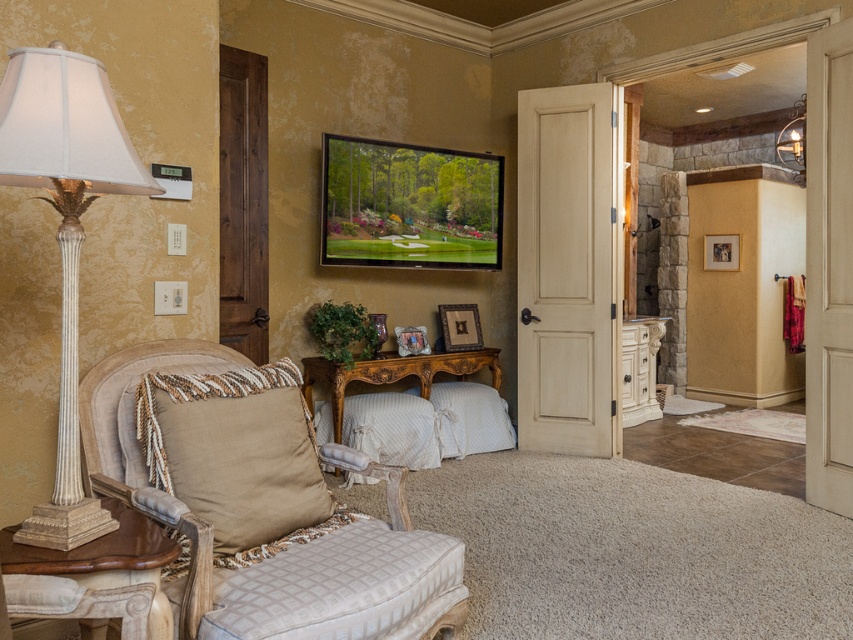
Question: Considering the relative positions of beige fabric armchair at lower left and wooden carved console table at center in the image provided, where is beige fabric armchair at lower left located with respect to wooden carved console table at center?

Choices:
 (A) right
 (B) left

Answer: (B)

Question: Is beige fabric pillow at lower left thinner than white quilted fabric stool at lower left?

Choices:
 (A) no
 (B) yes

Answer: (B)

Question: Among these points, which one is farthest from the camera?

Choices:
 (A) (795, 168)
 (B) (339, 564)
 (C) (100, 560)

Answer: (A)

Question: Observing the image, what is the correct spatial positioning of white quilted fabric stool at lower left in reference to wooden carved console table at center?

Choices:
 (A) left
 (B) right

Answer: (A)

Question: Considering the real-world distances, which object is closest to the metallic gold sconce at upper right?

Choices:
 (A) wooden carved console table at center
 (B) white textured lamp at left
 (C) wooden table at left

Answer: (A)

Question: Considering the real-world distances, which object is farthest from the beige fabric armchair at lower left?

Choices:
 (A) metallic gold sconce at upper right
 (B) white textured lamp at left
 (C) white quilted fabric stool at lower left
 (D) beige fabric pillow at lower left

Answer: (A)